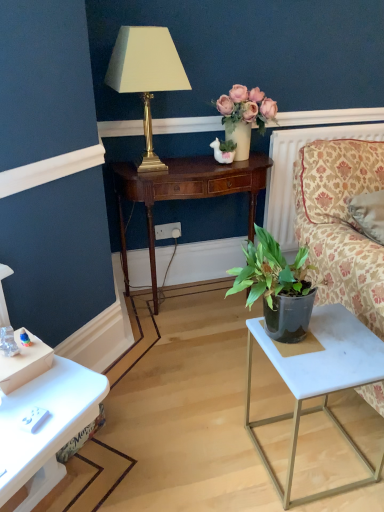
Question: From the image's perspective, is white plastic power outlet at center above or below matte cream vase at upper center?

Choices:
 (A) above
 (B) below

Answer: (B)

Question: Which is correct: white plastic power outlet at center is inside matte cream vase at upper center, or outside of it?

Choices:
 (A) outside
 (B) inside

Answer: (A)

Question: Which is farther from the white marble side table at lower right?

Choices:
 (A) matte cream vase at upper center
 (B) matte gold lamp at upper center
 (C) white textured radiator at upper right
 (D) white plastic power outlet at center
 (E) mahogany wood table at center

Answer: (D)

Question: Which object is the farthest from the white marble side table at lower right?

Choices:
 (A) white plastic power outlet at center
 (B) matte cream vase at upper center
 (C) white textured radiator at upper right
 (D) floral-patterned fabric couch at right
 (E) mahogany wood table at center

Answer: (A)